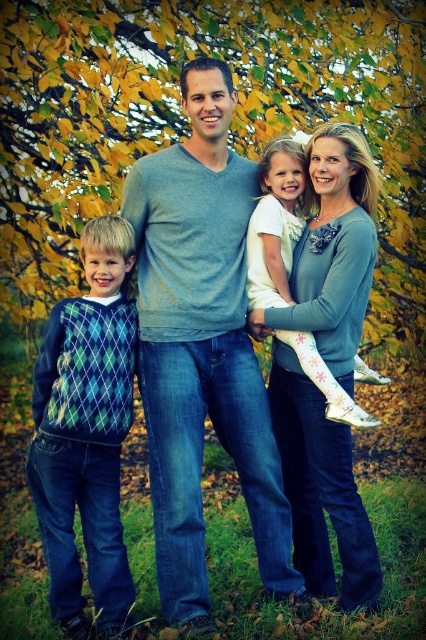
Question: Among these points, which one is farthest from the camera?

Choices:
 (A) (189, 138)
 (B) (85, 257)
 (C) (157, 122)

Answer: (C)

Question: Can you confirm if gray soft sweater at center is positioned above argyle sweater at left?

Choices:
 (A) yes
 (B) no

Answer: (A)

Question: Which of the following is the farthest from the observer?

Choices:
 (A) [x=393, y=116]
 (B) [x=268, y=552]
 (C) [x=275, y=176]
 (D) [x=62, y=387]

Answer: (A)

Question: Which object is closer to the camera taking this photo?

Choices:
 (A) gray soft sweater at center
 (B) argyle sweater at left

Answer: (A)

Question: Does yellow-green leaves at upper center have a greater width compared to gray soft sweater at center?

Choices:
 (A) no
 (B) yes

Answer: (A)

Question: Is yellow-green leaves at upper center wider than gray soft sweater at center?

Choices:
 (A) yes
 (B) no

Answer: (B)